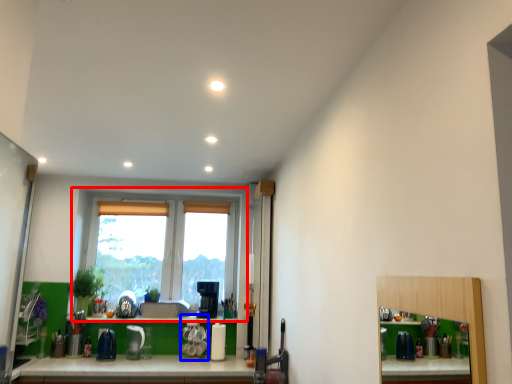
Question: Which object appears closest to the camera in this image, window (highlighted by a red box) or appliance (highlighted by a blue box)?

Choices:
 (A) window
 (B) appliance

Answer: (B)